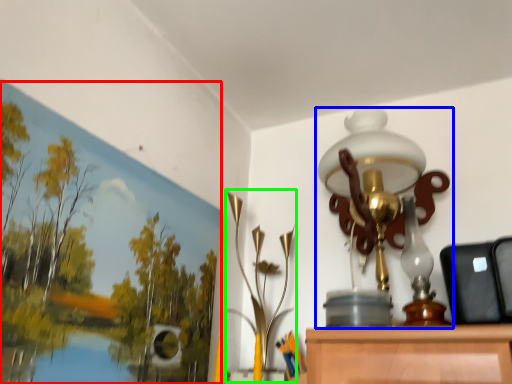
Question: Based on their relative distances, which object is nearer to oil painting (highlighted by a red box)? Choose from lamp (highlighted by a blue box) and lamp (highlighted by a green box).

Choices:
 (A) lamp
 (B) lamp

Answer: (B)